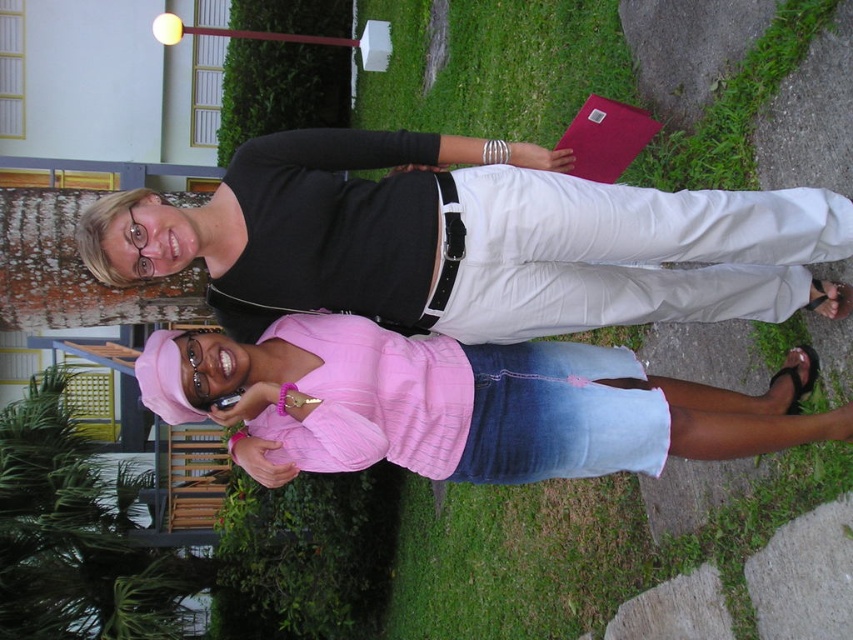
Between point (360, 288) and point (601, 396), which one is positioned behind?

Positioned behind is point (601, 396).

Is matte black shirt at center closer to the viewer compared to pink fabric shirt at center?

Yes, matte black shirt at center is closer to the viewer.

Is point (322, 284) farther from viewer compared to point (254, 406)?

Yes, point (322, 284) is farther from viewer.

The image size is (853, 640). I want to click on matte black shirt at center, so (467, 240).